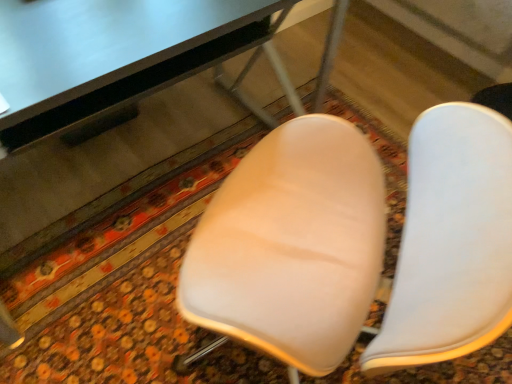
Question: Can you confirm if matte black table at upper center is thinner than white matte chair at center?

Choices:
 (A) no
 (B) yes

Answer: (B)

Question: Can you confirm if matte black table at upper center is positioned to the right of white matte chair at center?

Choices:
 (A) no
 (B) yes

Answer: (A)

Question: Can you confirm if matte black table at upper center is bigger than white matte chair at center?

Choices:
 (A) yes
 (B) no

Answer: (A)

Question: From the image's perspective, is matte black table at upper center on top of white matte chair at center?

Choices:
 (A) no
 (B) yes

Answer: (B)

Question: Considering the relative sizes of matte black table at upper center and white matte chair at center in the image provided, is matte black table at upper center taller than white matte chair at center?

Choices:
 (A) yes
 (B) no

Answer: (A)

Question: Does matte black table at upper center have a greater width compared to white matte chair at center?

Choices:
 (A) no
 (B) yes

Answer: (A)

Question: Is white matte chair at center outside matte black table at upper center?

Choices:
 (A) no
 (B) yes

Answer: (B)

Question: Is white matte chair at center closer to camera compared to matte black table at upper center?

Choices:
 (A) yes
 (B) no

Answer: (B)

Question: Considering the relative positions of white matte chair at center and matte black table at upper center in the image provided, is white matte chair at center to the left of matte black table at upper center from the viewer's perspective?

Choices:
 (A) yes
 (B) no

Answer: (B)

Question: Does white matte chair at center have a greater height compared to matte black table at upper center?

Choices:
 (A) yes
 (B) no

Answer: (B)

Question: Would you say white matte chair at center is a long distance from matte black table at upper center?

Choices:
 (A) yes
 (B) no

Answer: (B)

Question: Can you confirm if white matte chair at center is smaller than matte black table at upper center?

Choices:
 (A) no
 (B) yes

Answer: (B)

Question: From the image's perspective, is matte black table at upper center located above or below white matte chair at center?

Choices:
 (A) below
 (B) above

Answer: (B)